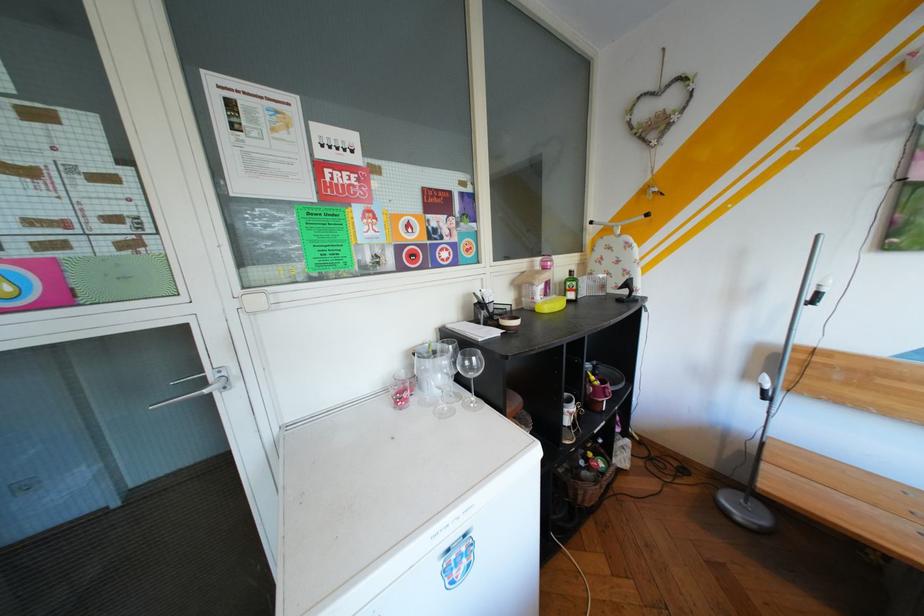
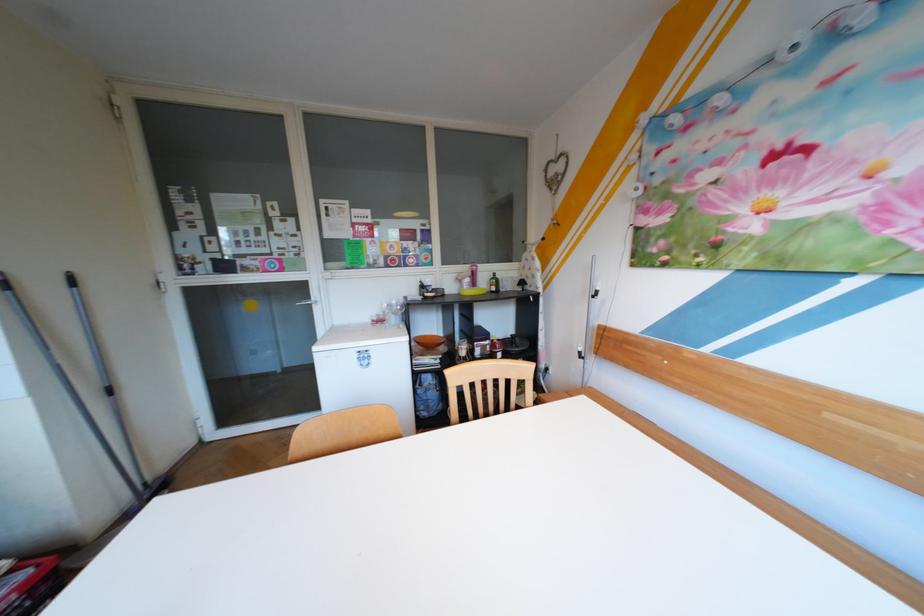
The images are taken continuously from a first-person perspective. In which direction are you moving?

The cameraman walked toward right, backward.